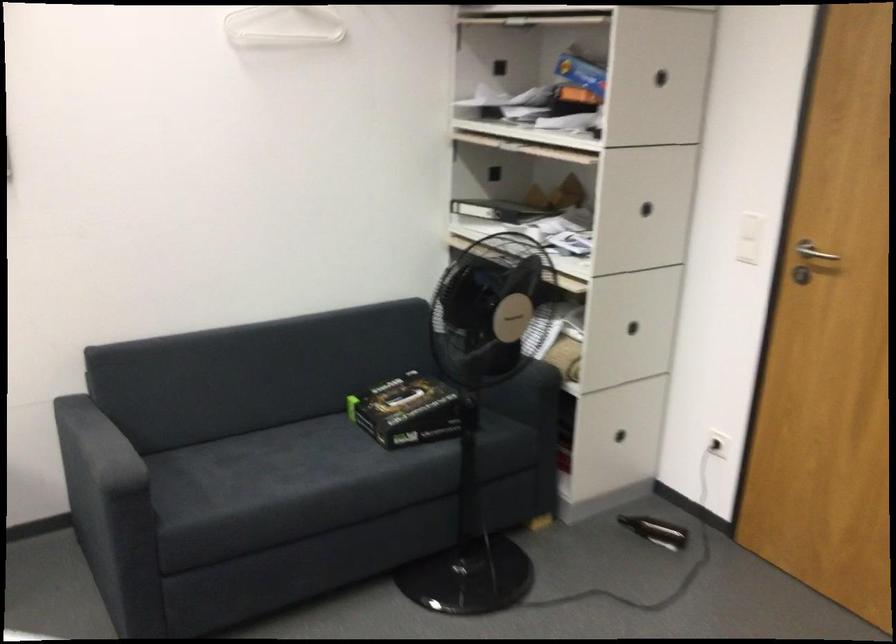
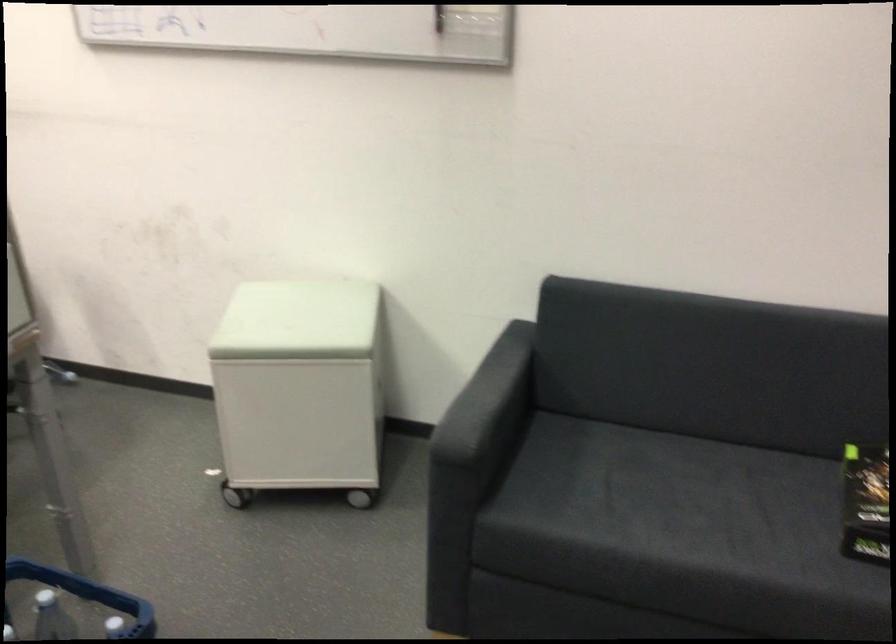
Where in the second image is the point corresponding to (x=113, y=448) from the first image?

(487, 401)